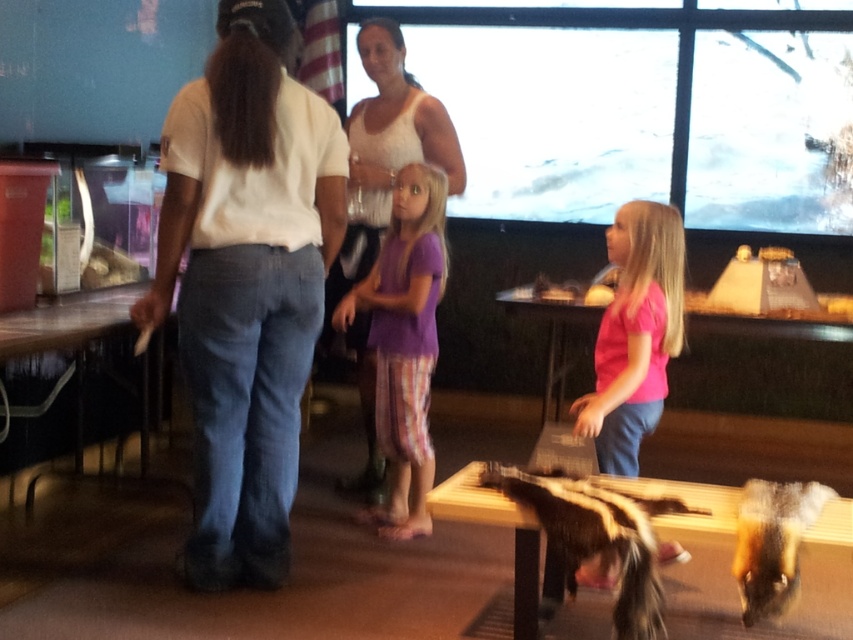
Question: Which is nearer to the dark brown wooden picnic table at left?

Choices:
 (A) white cotton shirt at center
 (B) fluffy brown and black skunk at center

Answer: (A)

Question: Considering the relative positions of purple cotton shirt at center and fluffy brown and black skunk at center in the image provided, where is purple cotton shirt at center located with respect to fluffy brown and black skunk at center?

Choices:
 (A) right
 (B) left

Answer: (B)

Question: Is white cotton shirt at center positioned behind pink matte shirt at center?

Choices:
 (A) yes
 (B) no

Answer: (B)

Question: Among these points, which one is farthest from the camera?

Choices:
 (A) (761, 520)
 (B) (300, 321)

Answer: (B)

Question: Based on their relative distances, which object is farther from the striped fur skunk at lower center?

Choices:
 (A) purple cotton shirt at center
 (B) pink matte shirt at center
 (C) fluffy brown and black skunk at center

Answer: (A)

Question: Does purple cotton shirt at center come in front of fluffy brown and black skunk at center?

Choices:
 (A) yes
 (B) no

Answer: (B)